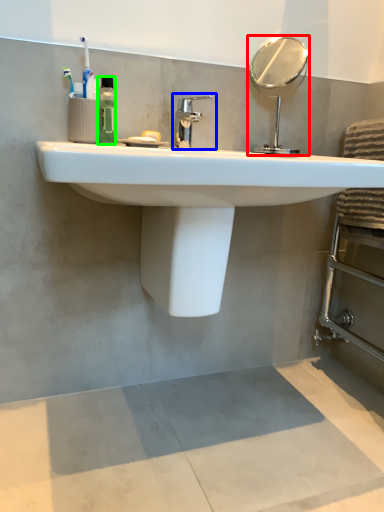
Question: Which is farther away from mirror (highlighted by a red box)? tap (highlighted by a blue box) or mouthwash (highlighted by a green box)?

Choices:
 (A) tap
 (B) mouthwash

Answer: (B)